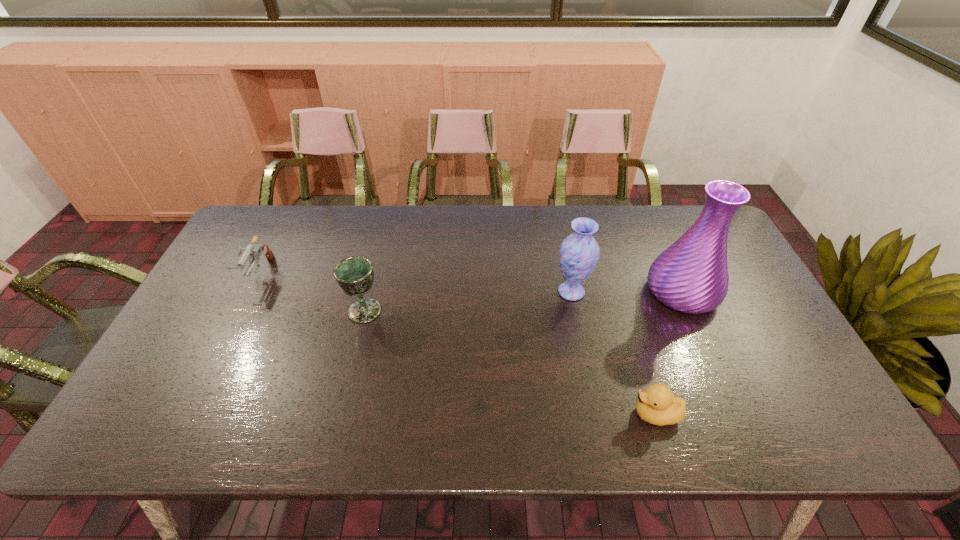
Locate an element on the screen. vacant space located 0.050m on the front of the shorter vase is located at coordinates (577, 319).

Identify the location of vacant space positioned on the front of the second object from left to right. This screenshot has height=540, width=960. (337, 424).

Identify the location of free location located 0.210m at the barrel end of the leftmost object. pos(219,352).

Find the location of a particular element. vacant space located 0.370m on the face of the duckling is located at coordinates (469, 414).

Where is `vacant space situated on the face of the duckling`? The width and height of the screenshot is (960, 540). vacant space situated on the face of the duckling is located at coordinates (496, 414).

Where is `vacant space situated 0.290m on the face of the duckling`? This screenshot has width=960, height=540. vacant space situated 0.290m on the face of the duckling is located at coordinates (505, 414).

Find the location of `object positioned at the near edge`. object positioned at the near edge is located at coordinates (656, 405).

I want to click on object present at the left edge, so click(251, 251).

What are the coordinates of `object at the right edge` in the screenshot? It's located at (691, 276).

At what (x,y) coordinates should I click in order to perform the action: click on vacant space at the far edge of the desktop. Please return your answer as a coordinate pair (x, y). Image resolution: width=960 pixels, height=540 pixels. Looking at the image, I should click on (308, 217).